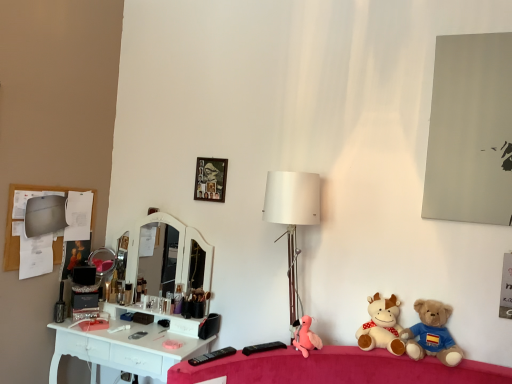
Question: Is matte black makeup brush at left inside soft plush cow at lower right, acting as the second toy starting from the left?

Choices:
 (A) yes
 (B) no

Answer: (B)

Question: From the image's perspective, is soft plush cow at lower right, acting as the second toy starting from the right, on top of matte black makeup brush at left?

Choices:
 (A) yes
 (B) no

Answer: (B)

Question: Can you confirm if soft plush cow at lower right, acting as the second toy starting from the right, is thinner than matte black makeup brush at left?

Choices:
 (A) yes
 (B) no

Answer: (B)

Question: Considering the relative positions of soft plush cow at lower right, acting as the second toy starting from the right, and matte black makeup brush at left in the image provided, is soft plush cow at lower right, acting as the second toy starting from the right, behind matte black makeup brush at left?

Choices:
 (A) yes
 (B) no

Answer: (B)

Question: Is soft plush cow at lower right, acting as the second toy starting from the right, smaller than matte black makeup brush at left?

Choices:
 (A) no
 (B) yes

Answer: (A)

Question: From a real-world perspective, is soft plush cow at lower right, acting as the second toy starting from the right, positioned under matte black makeup brush at left based on gravity?

Choices:
 (A) yes
 (B) no

Answer: (B)

Question: Considering the relative sizes of matte gray mirror at upper right and pink plush at center, acting as the first toy starting from the left, in the image provided, is matte gray mirror at upper right bigger than pink plush at center, acting as the first toy starting from the left,?

Choices:
 (A) no
 (B) yes

Answer: (B)

Question: Considering the relative positions of matte gray mirror at upper right and pink plush at center, acting as the 3th toy starting from the right, in the image provided, is matte gray mirror at upper right to the right of pink plush at center, acting as the 3th toy starting from the right, from the viewer's perspective?

Choices:
 (A) no
 (B) yes

Answer: (B)

Question: Considering the relative sizes of matte gray mirror at upper right and pink plush at center, acting as the first toy starting from the left, in the image provided, is matte gray mirror at upper right wider than pink plush at center, acting as the first toy starting from the left,?

Choices:
 (A) no
 (B) yes

Answer: (A)

Question: Is the depth of matte gray mirror at upper right less than that of pink plush at center, acting as the first toy starting from the left?

Choices:
 (A) yes
 (B) no

Answer: (B)

Question: From a real-world perspective, is matte gray mirror at upper right positioned under pink plush at center, acting as the first toy starting from the left, based on gravity?

Choices:
 (A) yes
 (B) no

Answer: (B)

Question: Is matte gray mirror at upper right at the left side of pink plush at center, acting as the first toy starting from the left?

Choices:
 (A) yes
 (B) no

Answer: (B)

Question: Can you confirm if brown plush bear at lower right, which appears as the first toy when viewed from the right, is thinner than matte black makeup brush at left?

Choices:
 (A) yes
 (B) no

Answer: (B)